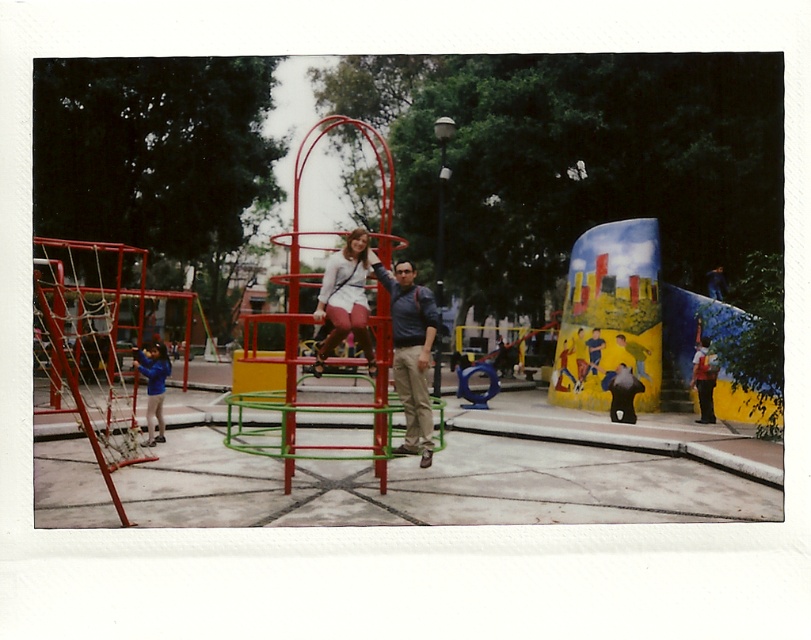
Question: Can you confirm if matte blue shirt at center is positioned to the right of red fabric jacket at right?

Choices:
 (A) yes
 (B) no

Answer: (B)

Question: Is metallic red playground equipment at center behind red fabric jacket at right?

Choices:
 (A) yes
 (B) no

Answer: (B)

Question: Which object is farther from the camera taking this photo?

Choices:
 (A) metallic red playground equipment at center
 (B) red fabric jacket at right
 (C) matte blue shirt at center

Answer: (B)

Question: Which of the following is the closest to the observer?

Choices:
 (A) (320, 371)
 (B) (706, 337)
 (C) (159, 417)
 (D) (256, 106)

Answer: (A)

Question: Which point is farther to the camera?

Choices:
 (A) (361, 275)
 (B) (471, 141)
 (C) (157, 346)

Answer: (B)

Question: Can you confirm if matte blue shirt at center is positioned to the left of blue fleece jacket at lower left?

Choices:
 (A) yes
 (B) no

Answer: (B)